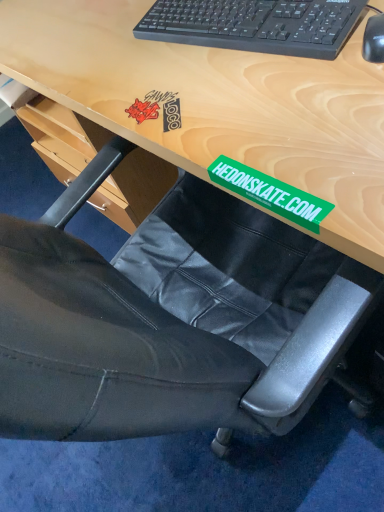
Image resolution: width=384 pixels, height=512 pixels. What do you see at coordinates (374, 39) in the screenshot?
I see `black plastic mouse at upper right` at bounding box center [374, 39].

Find the location of a particular element. This screenshot has height=512, width=384. black plastic mouse at upper right is located at coordinates (374, 39).

In order to face black plastic keyboard at upper center, should I rotate leftwards or rightwards?

Rotate right and turn 6.561 degrees.

What do you see at coordinates (255, 25) in the screenshot?
I see `black plastic keyboard at upper center` at bounding box center [255, 25].

The height and width of the screenshot is (512, 384). In order to click on black plastic keyboard at upper center in this screenshot , I will do `click(255, 25)`.

Measure the distance between black plastic keyboard at upper center and camera.

black plastic keyboard at upper center is 27.42 inches from camera.

At what (x,y) coordinates should I click in order to perform the action: click on black plastic mouse at upper right. Please return your answer as a coordinate pair (x, y). The width and height of the screenshot is (384, 512). Looking at the image, I should click on (374, 39).

Considering the relative positions of black plastic mouse at upper right and black plastic keyboard at upper center in the image provided, is black plastic mouse at upper right to the left or to the right of black plastic keyboard at upper center?

From the image, it's evident that black plastic mouse at upper right is to the right of black plastic keyboard at upper center.

Which object is closer to the camera taking this photo, black plastic mouse at upper right or black plastic keyboard at upper center?

Positioned in front is black plastic mouse at upper right.

Considering the positions of point (364, 53) and point (168, 10), is point (364, 53) closer or farther from the camera than point (168, 10)?

Point (364, 53) is closer to the camera than point (168, 10).

From the image's perspective, is black plastic mouse at upper right positioned above or below black plastic keyboard at upper center?

black plastic mouse at upper right is situated lower than black plastic keyboard at upper center in the image.

From a real-world perspective, which object stands above the other?

black plastic keyboard at upper center, from a real-world perspective.

Which object is wider, black plastic mouse at upper right or black plastic keyboard at upper center?

Wider between the two is black plastic keyboard at upper center.

Which of these two, black plastic mouse at upper right or black plastic keyboard at upper center, stands shorter?

black plastic mouse at upper right.

Can you confirm if black plastic mouse at upper right is smaller than black plastic keyboard at upper center?

Correct, black plastic mouse at upper right occupies less space than black plastic keyboard at upper center.

Choose the correct answer: Is black plastic mouse at upper right inside black plastic keyboard at upper center or outside it?

black plastic mouse at upper right cannot be found inside black plastic keyboard at upper center.

Can you see black plastic mouse at upper right touching black plastic keyboard at upper center?

No.

Is black plastic mouse at upper right facing towards black plastic keyboard at upper center?

No.

How many degrees apart are the facing directions of black plastic mouse at upper right and black plastic keyboard at upper center?

The facing directions of black plastic mouse at upper right and black plastic keyboard at upper center are 15.6 degrees apart.

Where is `computer keyboard above the black plastic mouse at upper right (from the image's perspective)`? Image resolution: width=384 pixels, height=512 pixels. computer keyboard above the black plastic mouse at upper right (from the image's perspective) is located at coordinates [x=255, y=25].

Is black plastic keyboard at upper center at the right side of black plastic mouse at upper right?

Incorrect, black plastic keyboard at upper center is not on the right side of black plastic mouse at upper right.

Does black plastic keyboard at upper center come behind black plastic mouse at upper right?

That is True.

Which is in front, point (306, 3) or point (374, 37)?

The point (374, 37) is closer to the camera.

In the scene shown: From the image's perspective, relative to black plastic mouse at upper right, is black plastic keyboard at upper center above or below?

black plastic keyboard at upper center is situated higher than black plastic mouse at upper right in the image.

From a real-world perspective, between black plastic keyboard at upper center and black plastic mouse at upper right, who is vertically lower?

From a 3D spatial view, black plastic mouse at upper right is below.

Considering the sizes of objects black plastic keyboard at upper center and black plastic mouse at upper right in the image provided, who is wider, black plastic keyboard at upper center or black plastic mouse at upper right?

With larger width is black plastic keyboard at upper center.

Who is shorter, black plastic keyboard at upper center or black plastic mouse at upper right?

black plastic mouse at upper right is shorter.

Based on the photo, which of these two, black plastic keyboard at upper center or black plastic mouse at upper right, is bigger?

With larger size is black plastic keyboard at upper center.

From the picture: Can we say black plastic keyboard at upper center lies outside black plastic mouse at upper right?

That's correct, black plastic keyboard at upper center is outside of black plastic mouse at upper right.

Is black plastic keyboard at upper center placed right next to black plastic mouse at upper right?

No, black plastic keyboard at upper center is not touching black plastic mouse at upper right.

Could you tell me if black plastic keyboard at upper center is turned towards black plastic mouse at upper right?

No.

How different are the orientations of black plastic keyboard at upper center and black plastic mouse at upper right in degrees?

The angle between the facing direction of black plastic keyboard at upper center and the facing direction of black plastic mouse at upper right is 15.6 degrees.

This screenshot has width=384, height=512. Identify the location of computer keyboard on the left of black plastic mouse at upper right. (255, 25).

The height and width of the screenshot is (512, 384). Find the location of `computer keyboard located behind the black plastic mouse at upper right`. computer keyboard located behind the black plastic mouse at upper right is located at coordinates (255, 25).

I want to click on computer keyboard above the black plastic mouse at upper right (from the image's perspective), so click(255, 25).